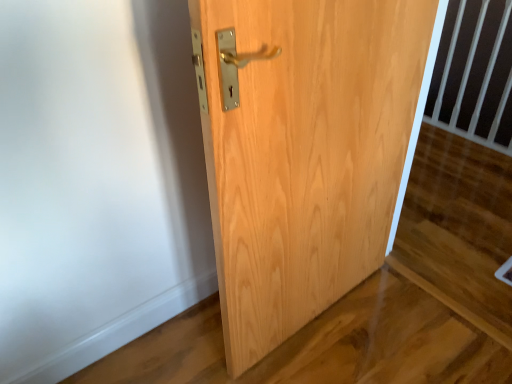
Question: From the image's perspective, is natural wood door at center located above or below black plastic balustrade at upper right?

Choices:
 (A) below
 (B) above

Answer: (A)

Question: From a real-world perspective, is natural wood door at center physically located above or below black plastic balustrade at upper right?

Choices:
 (A) above
 (B) below

Answer: (A)

Question: Is natural wood door at center wider or thinner than black plastic balustrade at upper right?

Choices:
 (A) thin
 (B) wide

Answer: (B)

Question: Based on their sizes in the image, would you say black plastic balustrade at upper right is bigger or smaller than natural wood door at center?

Choices:
 (A) small
 (B) big

Answer: (A)

Question: Considering the positions of black plastic balustrade at upper right and natural wood door at center in the image, is black plastic balustrade at upper right wider or thinner than natural wood door at center?

Choices:
 (A) thin
 (B) wide

Answer: (A)

Question: Considering their positions, is black plastic balustrade at upper right located in front of or behind natural wood door at center?

Choices:
 (A) behind
 (B) front

Answer: (A)

Question: Is black plastic balustrade at upper right inside the boundaries of natural wood door at center, or outside?

Choices:
 (A) outside
 (B) inside

Answer: (A)